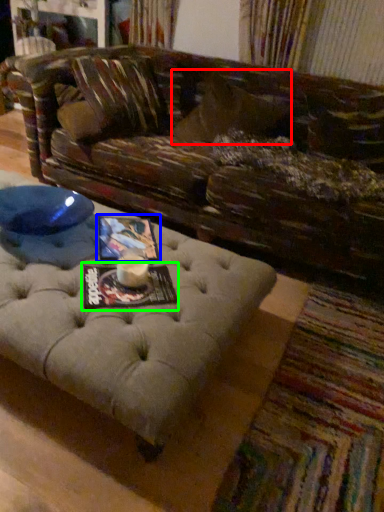
Question: Estimate the real-world distances between objects in this image. Which object is farther from pillow (highlighted by a red box), magazine (highlighted by a blue box) or magazine (highlighted by a green box)?

Choices:
 (A) magazine
 (B) magazine

Answer: (B)